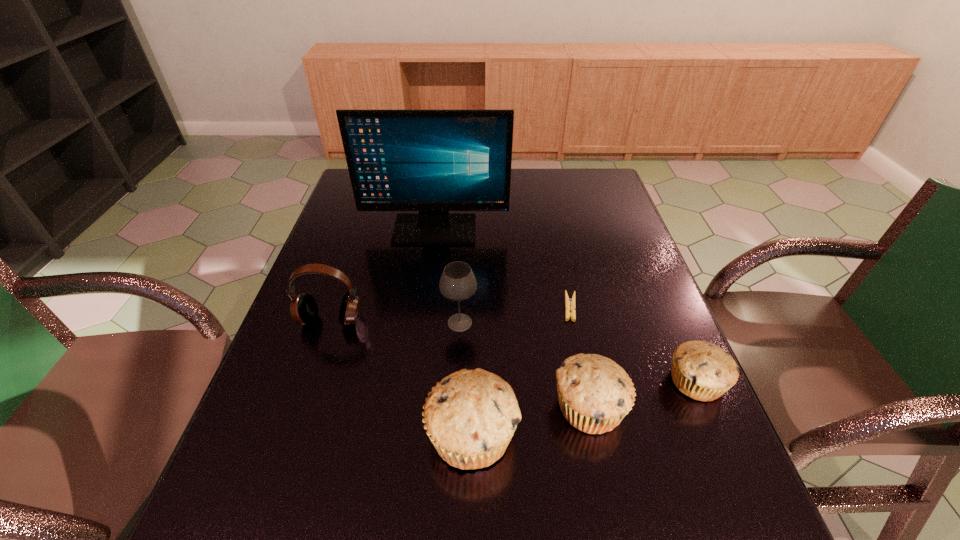
In the image, there is a desktop. Identify the location of blank space at the near edge. The width and height of the screenshot is (960, 540). (594, 471).

You are a GUI agent. You are given a task and a screenshot of the screen. Output one action in this format:
    pyautogui.click(x=<x>, y=<y>)
    Task: Click on the vacant area at the left edge
    This screenshot has height=540, width=960.
    Given the screenshot: What is the action you would take?
    pyautogui.click(x=334, y=234)

Identify the location of vacant space at the right edge. (620, 310).

Locate an element on the screen. free spot at the far left corner of the desktop is located at coordinates (353, 192).

Image resolution: width=960 pixels, height=540 pixels. What are the coordinates of `vacant space at the near left corner of the desktop` in the screenshot? It's located at (285, 452).

This screenshot has height=540, width=960. I want to click on free location at the far right corner, so click(576, 188).

Find the location of a particular element. Image resolution: width=960 pixels, height=540 pixels. free point between the shortest object and the leftmost muffin is located at coordinates (521, 371).

Identify the location of vacant space that's between the fifth tallest object and the tallest object. click(513, 318).

Where is `free point between the clothespin and the leftmost muffin`? This screenshot has height=540, width=960. free point between the clothespin and the leftmost muffin is located at coordinates (521, 371).

What are the coordinates of `free space between the farthest object and the leftmost muffin` in the screenshot? It's located at (453, 332).